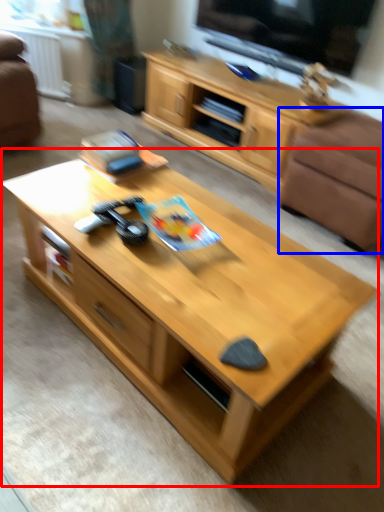
Question: Which point is further to the camera, coffee table (highlighted by a red box) or armchair (highlighted by a blue box)?

Choices:
 (A) coffee table
 (B) armchair

Answer: (B)